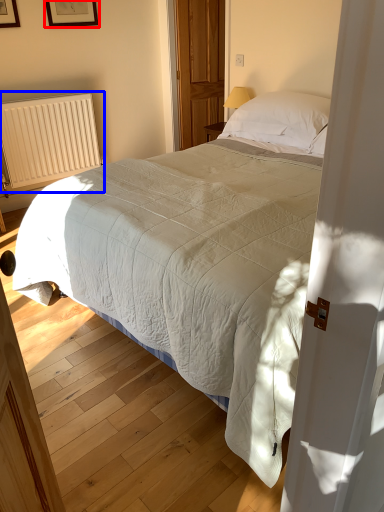
Question: Which object is further to the camera taking this photo, picture frame (highlighted by a red box) or radiator (highlighted by a blue box)?

Choices:
 (A) picture frame
 (B) radiator

Answer: (A)